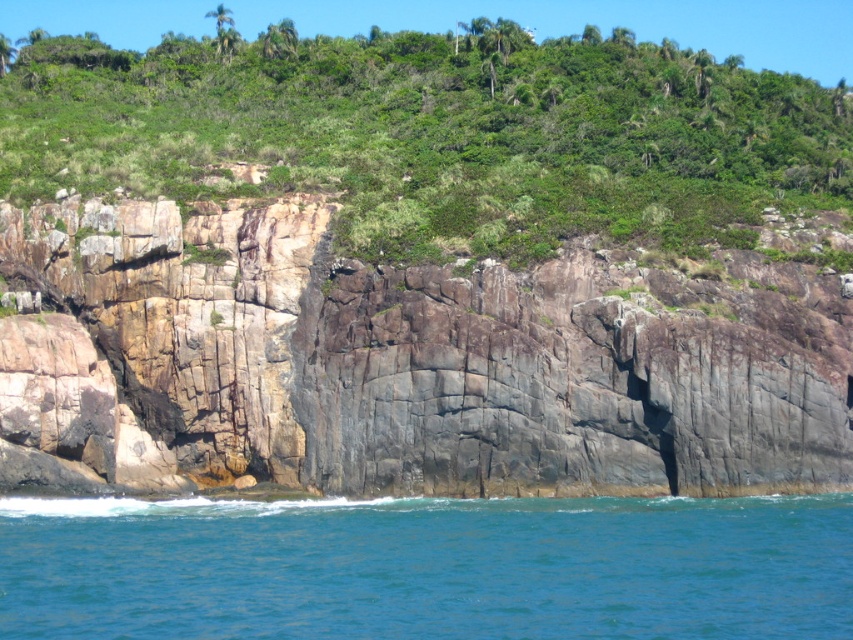
Question: Among these objects, which one is nearest to the camera?

Choices:
 (A) blue water at lower left
 (B) gray/rocky cliff at center

Answer: (A)

Question: Which object appears farthest from the camera in this image?

Choices:
 (A) green leafy vegetation at upper center
 (B) gray/rocky cliff at center

Answer: (A)

Question: Does green leafy vegetation at upper center appear over blue water at lower left?

Choices:
 (A) no
 (B) yes

Answer: (B)

Question: Which point is farther to the camera?

Choices:
 (A) (248, 132)
 (B) (171, 275)

Answer: (A)

Question: Can you confirm if gray/rocky cliff at center is smaller than blue water at lower left?

Choices:
 (A) yes
 (B) no

Answer: (B)

Question: Is green leafy vegetation at upper center thinner than blue water at lower left?

Choices:
 (A) yes
 (B) no

Answer: (B)